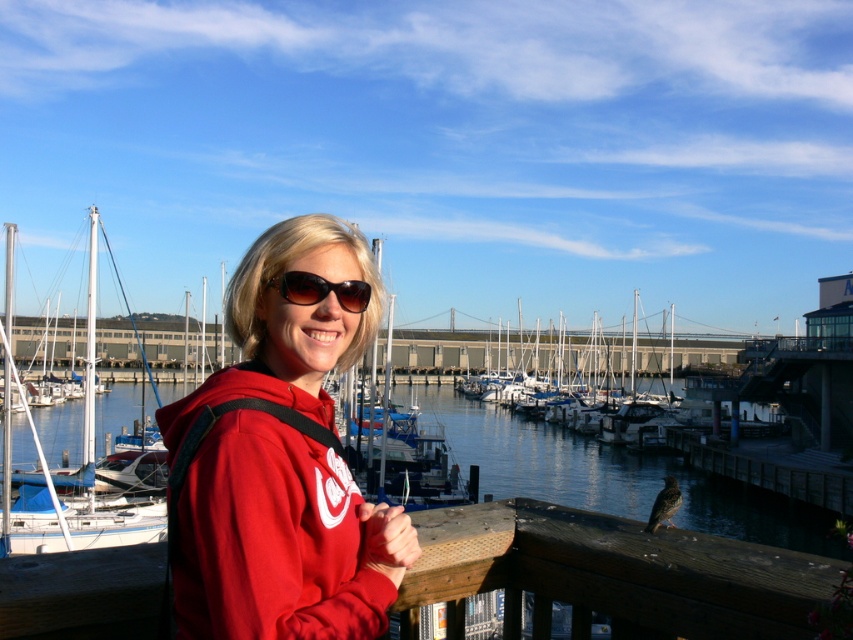
You are standing at the marina and see the matte red hoodie at center and the matte blue sailboat at center. Which object is positioned more to the right side of the scene?

The matte red hoodie at center is positioned more to the right side of the scene than the matte blue sailboat at center.

You are a photographer positioned at the wooden railing and want to capture both the matte blue sailboat at center and the white glossy sailboat at left in a single shot. Based on their positions, which sailboat should you adjust your camera to focus on first to ensure both are in frame?

The matte blue sailboat at center is to the right of the white glossy sailboat at left, so you should focus on the white glossy sailboat at left first to ensure both are captured in the frame.